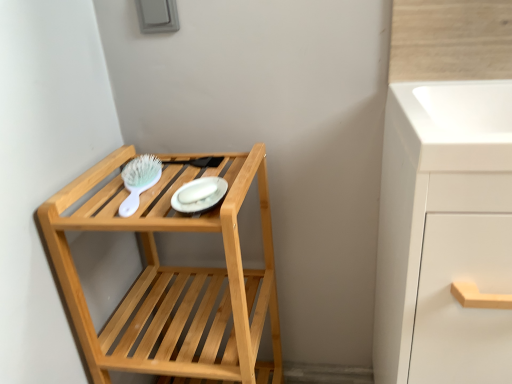
Question: Is green plastic brush at upper left to the left or to the right of natural wood shelf at left in the image?

Choices:
 (A) left
 (B) right

Answer: (A)

Question: Do you think green plastic brush at upper left is within natural wood shelf at left, or outside of it?

Choices:
 (A) outside
 (B) inside

Answer: (B)

Question: Which object is positioned closest to the white glossy platter at center?

Choices:
 (A) white matte cabinet at right
 (B) natural wood shelf at left
 (C) green plastic brush at upper left

Answer: (C)

Question: Which is farther from the natural wood shelf at left?

Choices:
 (A) white glossy platter at center
 (B) green plastic brush at upper left
 (C) white matte cabinet at right

Answer: (C)